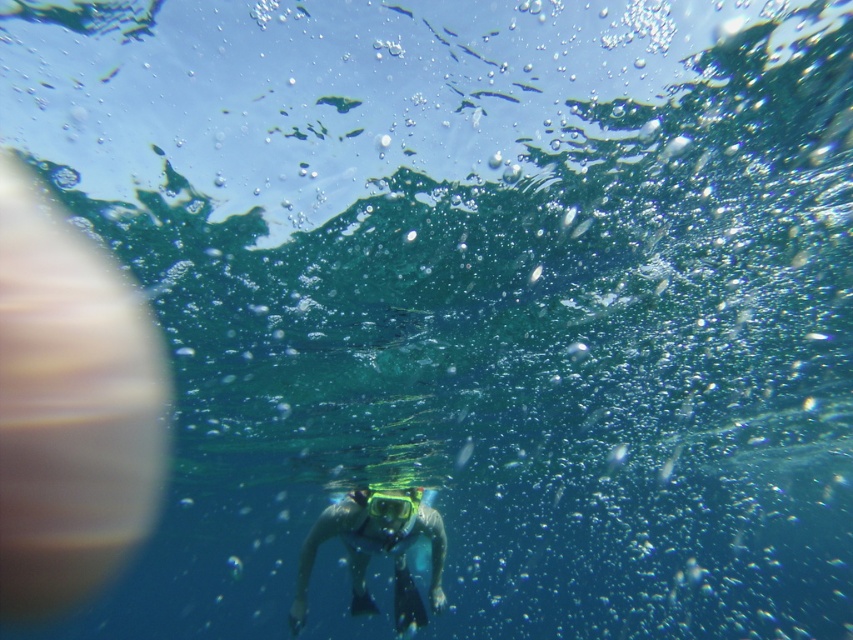
Between blue matte snorkeling gear at center and clear plastic goggles at center, which one is positioned lower?

Positioned lower is blue matte snorkeling gear at center.

Is blue matte snorkeling gear at center thinner than clear plastic goggles at center?

Incorrect, blue matte snorkeling gear at center's width is not less than clear plastic goggles at center's.

Does point (305, 577) lie in front of point (386, 500)?

No, (305, 577) is behind (386, 500).

Locate an element on the screen. The height and width of the screenshot is (640, 853). blue matte snorkeling gear at center is located at coordinates (376, 552).